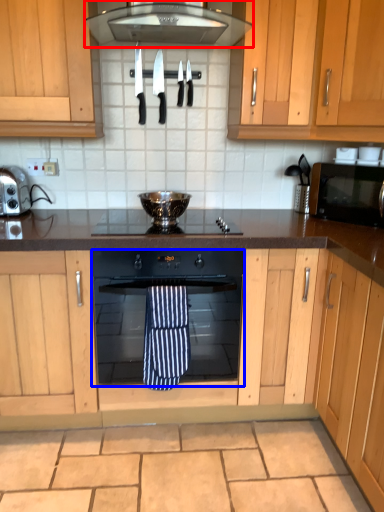
Question: Among these objects, which one is farthest to the camera, home appliance (highlighted by a red box) or oven (highlighted by a blue box)?

Choices:
 (A) home appliance
 (B) oven

Answer: (B)